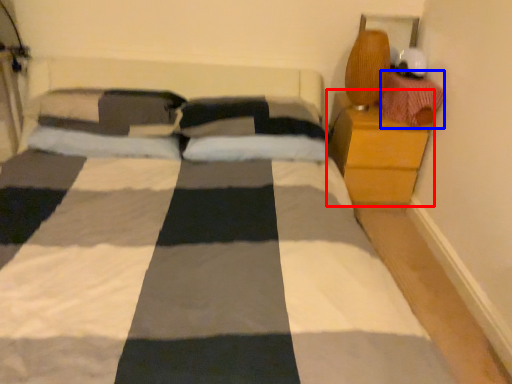
Question: Which of the following is the farthest to the observer, nightstand (highlighted by a red box) or material (highlighted by a blue box)?

Choices:
 (A) nightstand
 (B) material

Answer: (A)